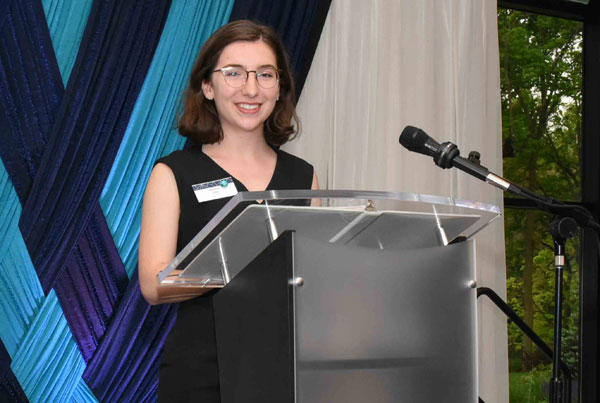
Locate an element on the screen. Image resolution: width=600 pixels, height=403 pixels. thick clear plastic on the top of the podium is located at coordinates (241, 198), (338, 200), (429, 203), (486, 215), (175, 277).